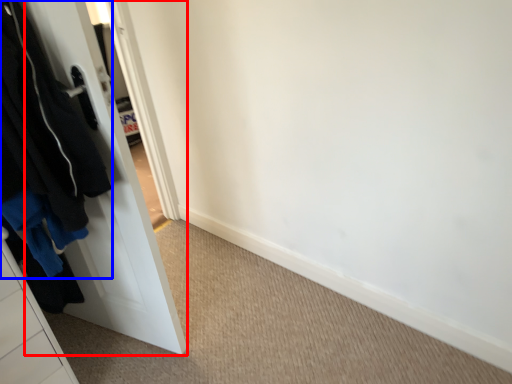
Question: Which of the following is the closest to the observer, door (highlighted by a red box) or clothing (highlighted by a blue box)?

Choices:
 (A) door
 (B) clothing

Answer: (B)